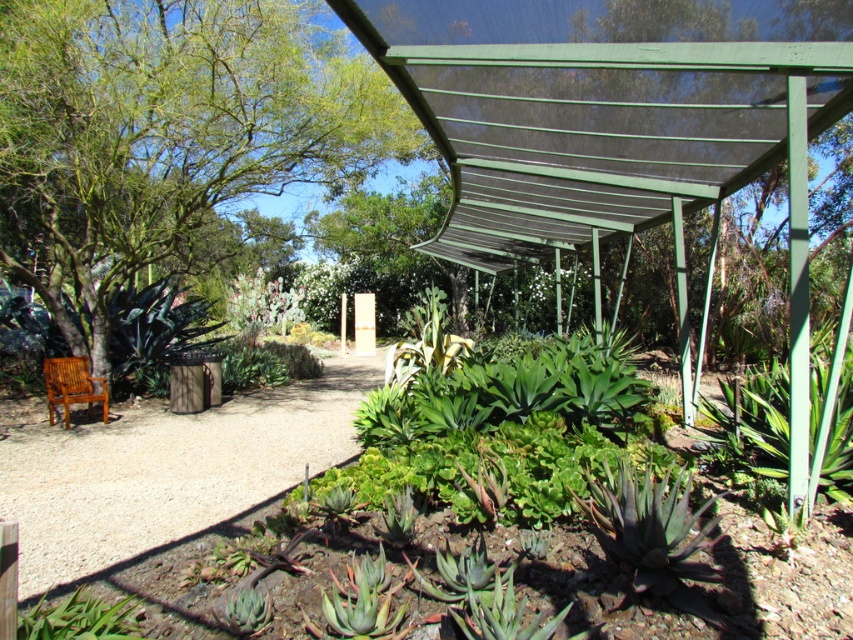
Between point (212, 186) and point (77, 369), which one is positioned in front?

Positioned in front is point (77, 369).

What do you see at coordinates (165, 132) in the screenshot? I see `green leafy tree at left` at bounding box center [165, 132].

Identify the location of green leafy tree at left. Image resolution: width=853 pixels, height=640 pixels. (165, 132).

From the picture: Which is below, green leafy tree at left or gravel path at center?

gravel path at center

I want to click on green leafy tree at left, so click(x=165, y=132).

Image resolution: width=853 pixels, height=640 pixels. Describe the element at coordinates (165, 132) in the screenshot. I see `green leafy tree at left` at that location.

Locate an element on the screen. green leafy tree at left is located at coordinates (165, 132).

Which of these two, gravel path at center or teak wood park bench at lower left, stands shorter?

gravel path at center

Is point (86, 492) farther from viewer compared to point (67, 365)?

No, (86, 492) is in front of (67, 365).

Locate an element on the screen. gravel path at center is located at coordinates (164, 468).

This screenshot has width=853, height=640. What are the coordinates of `gravel path at center` in the screenshot? It's located at (164, 468).